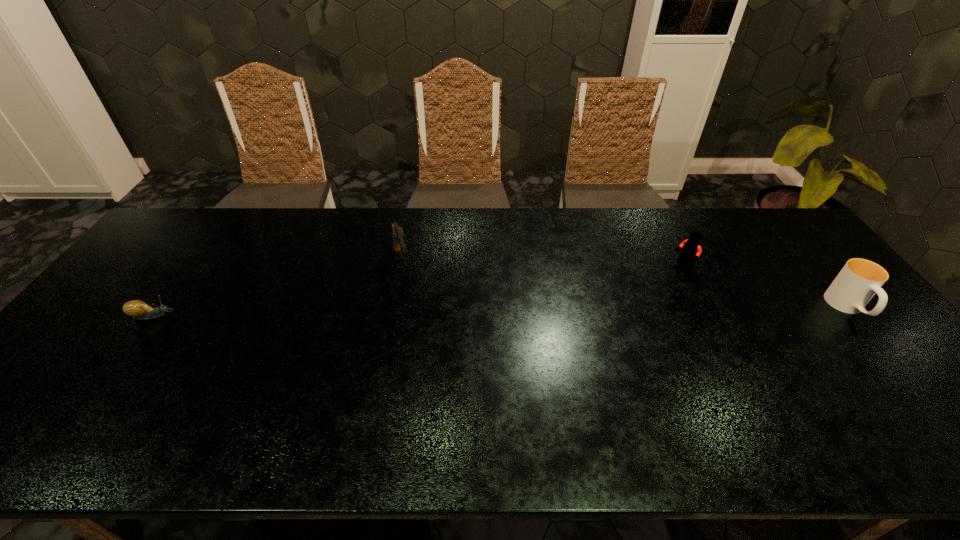
Find the location of a particular element. This screenshot has height=540, width=960. blank area located 0.100m along the barrel of the gun is located at coordinates (411, 308).

Locate an element on the screen. vacant space situated along the barrel of the gun is located at coordinates (422, 346).

This screenshot has width=960, height=540. What are the coordinates of `free location located 0.120m along the barrel of the gun` in the screenshot? It's located at (413, 313).

This screenshot has width=960, height=540. What are the coordinates of `object located at the far edge` in the screenshot? It's located at (399, 237).

The width and height of the screenshot is (960, 540). I want to click on object that is positioned at the left edge, so click(138, 309).

Identify the location of object positioned at the right edge. This screenshot has height=540, width=960. (859, 280).

In the image, there is a desktop. Where is `vacant region at the far edge`? Image resolution: width=960 pixels, height=540 pixels. vacant region at the far edge is located at coordinates (491, 213).

Locate an element on the screen. This screenshot has width=960, height=540. vacant space at the near edge of the desktop is located at coordinates (362, 400).

In the image, there is a desktop. Identify the location of free space at the left edge. (172, 281).

Locate an element on the screen. The height and width of the screenshot is (540, 960). free space at the right edge of the desktop is located at coordinates (879, 379).